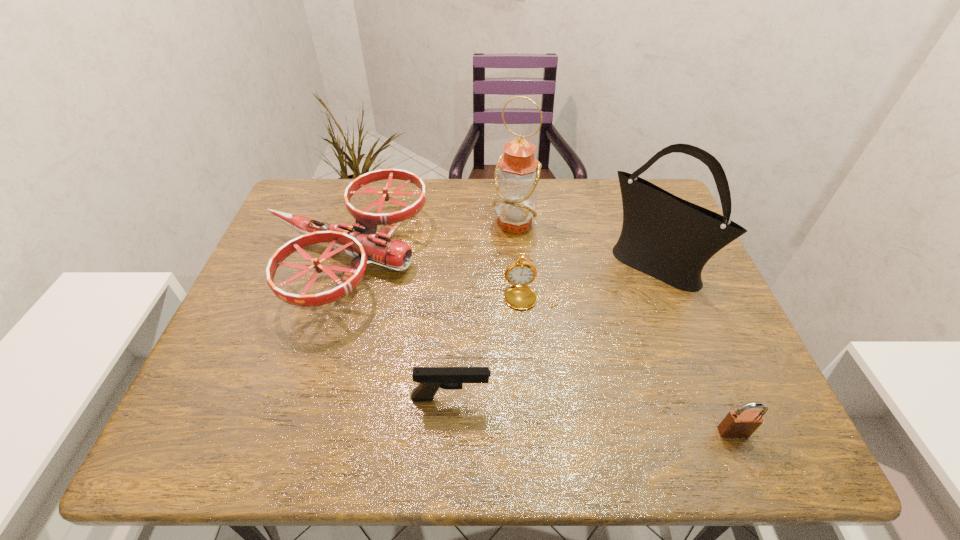
Locate an element on the screen. This screenshot has height=540, width=960. vacant area situated 0.120m on the face of the pocket watch is located at coordinates (537, 353).

Identify the location of vacant space situated on the front-facing side of the pistol. The image size is (960, 540). (549, 398).

Image resolution: width=960 pixels, height=540 pixels. Identify the location of oil lamp at the far edge. (517, 172).

Where is `drone that is at the far edge`? Image resolution: width=960 pixels, height=540 pixels. drone that is at the far edge is located at coordinates (364, 244).

Image resolution: width=960 pixels, height=540 pixels. Find the location of `object that is at the near edge`. object that is at the near edge is located at coordinates pyautogui.click(x=741, y=423).

This screenshot has width=960, height=540. What are the coordinates of `object at the left edge` in the screenshot? It's located at (364, 244).

Where is `shoulder bag that is at the right edge`? shoulder bag that is at the right edge is located at coordinates (666, 237).

Find the location of a particular element. This screenshot has width=960, height=540. padlock at the right edge is located at coordinates (741, 423).

In order to click on object at the far left corner in this screenshot , I will do `click(364, 244)`.

Where is `object that is at the near right corner`? This screenshot has height=540, width=960. object that is at the near right corner is located at coordinates [x=741, y=423].